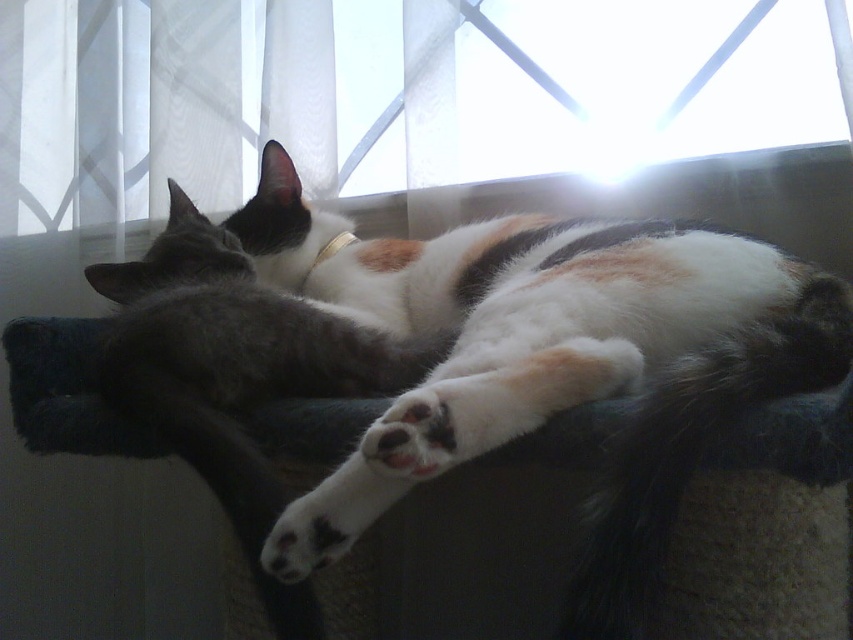
Question: Is white fur at center in front of transparent glass window at upper center?

Choices:
 (A) yes
 (B) no

Answer: (A)

Question: Is the position of white fur at center more distant than that of transparent glass window at upper center?

Choices:
 (A) no
 (B) yes

Answer: (A)

Question: Which of the following is the closest to the observer?

Choices:
 (A) (457, 355)
 (B) (254, 76)

Answer: (A)

Question: Does white fur at center come in front of transparent glass window at upper center?

Choices:
 (A) no
 (B) yes

Answer: (B)